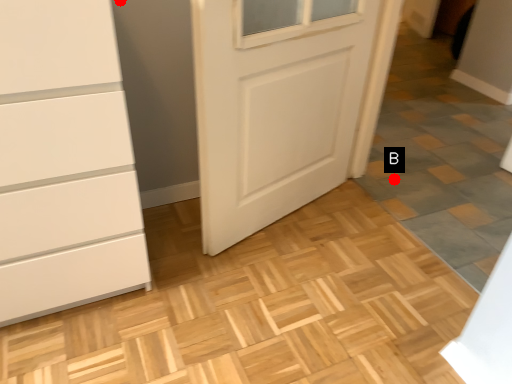
Question: Two points are circled on the image, labeled by A and B beside each circle. Which point is closer to the camera?

Choices:
 (A) A is closer
 (B) B is closer

Answer: (A)